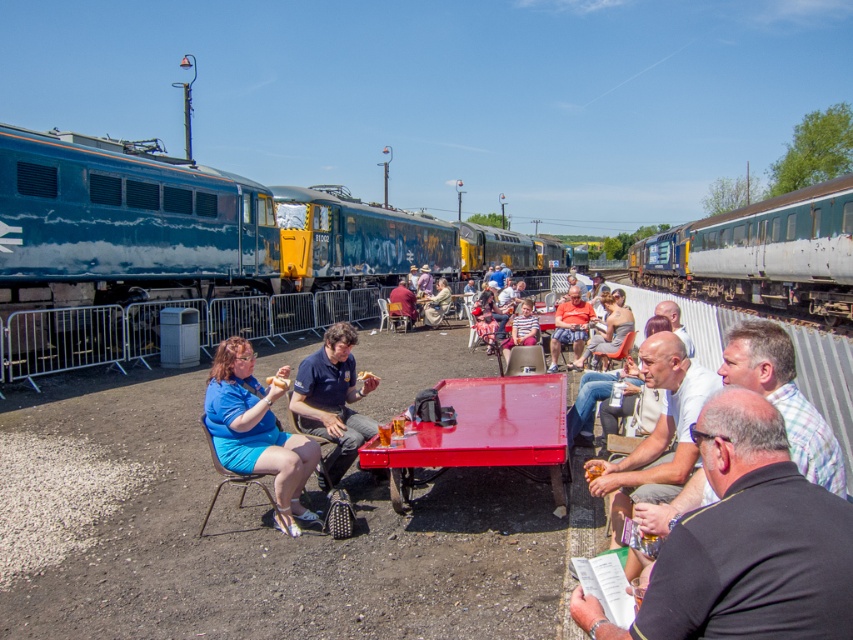
Between teal glossy locomotive at left and shiny red table at center, which one has more height?

teal glossy locomotive at left

Is teal glossy locomotive at left to the left of shiny red table at center from the viewer's perspective?

Incorrect, teal glossy locomotive at left is not on the left side of shiny red table at center.

Measure the distance between teal glossy locomotive at left and camera.

teal glossy locomotive at left and camera are 9.62 meters apart.

The height and width of the screenshot is (640, 853). Identify the location of teal glossy locomotive at left. (201, 250).

Between green metallic passenger train at center and orange fabric shorts at center, which one appears on the left side from the viewer's perspective?

orange fabric shorts at center

Does point (809, 225) lie in front of point (566, 339)?

That is False.

I want to click on green metallic passenger train at center, so click(761, 253).

Which is behind, point (508, 397) or point (660, 433)?

Positioned behind is point (508, 397).

The image size is (853, 640). Identify the location of shiny red table at center. (483, 432).

Locate an element on the screen. This screenshot has width=853, height=640. shiny red table at center is located at coordinates (483, 432).